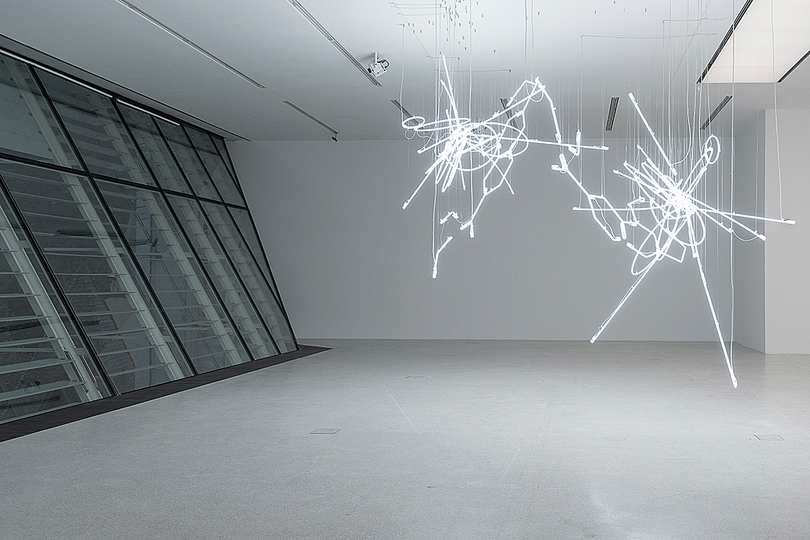
Where is `art installation, light fixure`? art installation, light fixure is located at coordinates (x=684, y=202), (x=457, y=138).